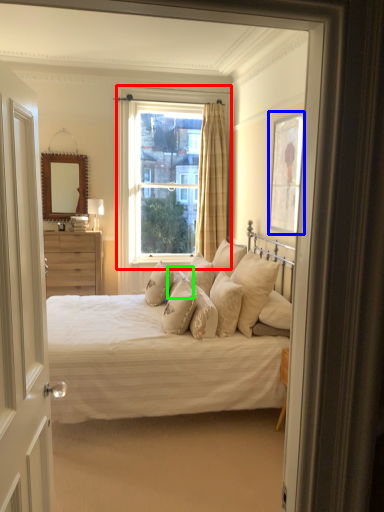
Question: Which object is positioned farthest from window (highlighted by a red box)? Select from picture frame (highlighted by a blue box) and pillow (highlighted by a green box).

Choices:
 (A) picture frame
 (B) pillow

Answer: (B)